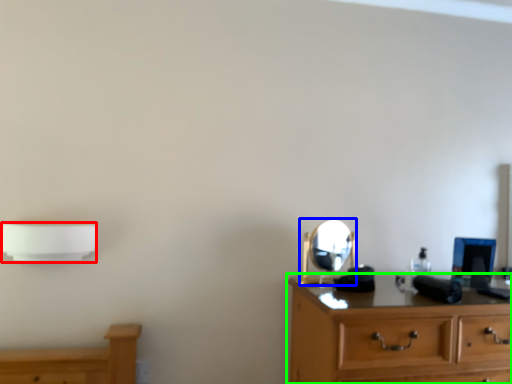
Question: Based on their relative distances, which object is nearer to lamp (highlighted by a red box)? Choose from mirror (highlighted by a blue box) and chest of drawers (highlighted by a green box).

Choices:
 (A) mirror
 (B) chest of drawers

Answer: (A)